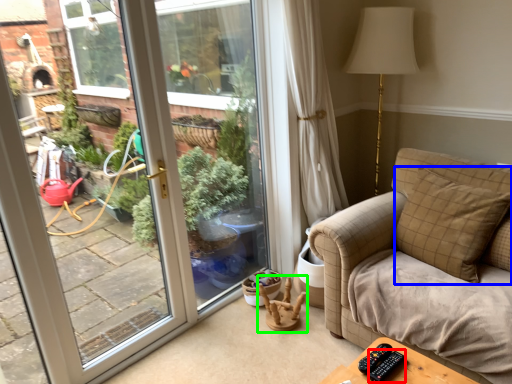
Question: Which object is positioned farthest from remote (highlighted by a red box)? Select from pillow (highlighted by a blue box) and rocking chair (highlighted by a green box).

Choices:
 (A) pillow
 (B) rocking chair

Answer: (B)